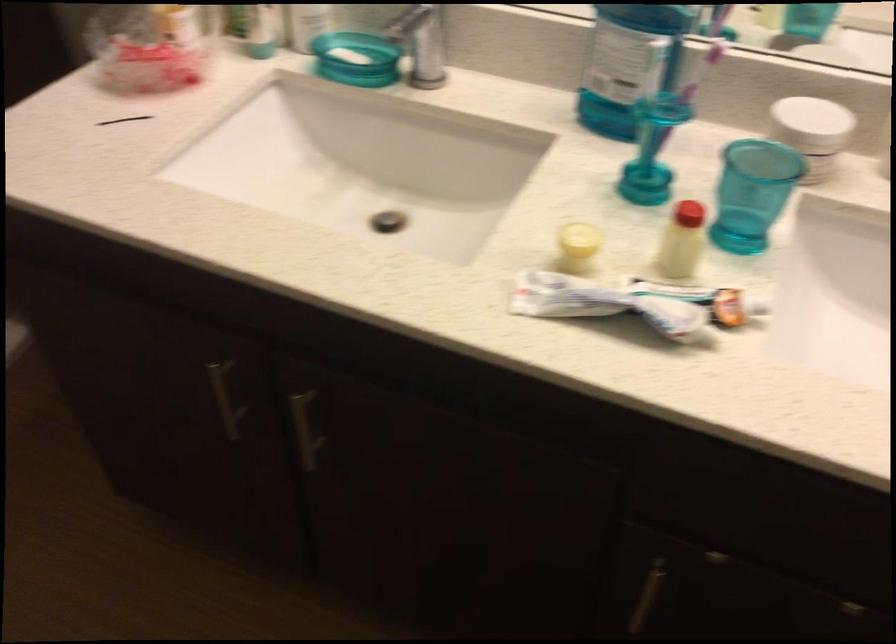
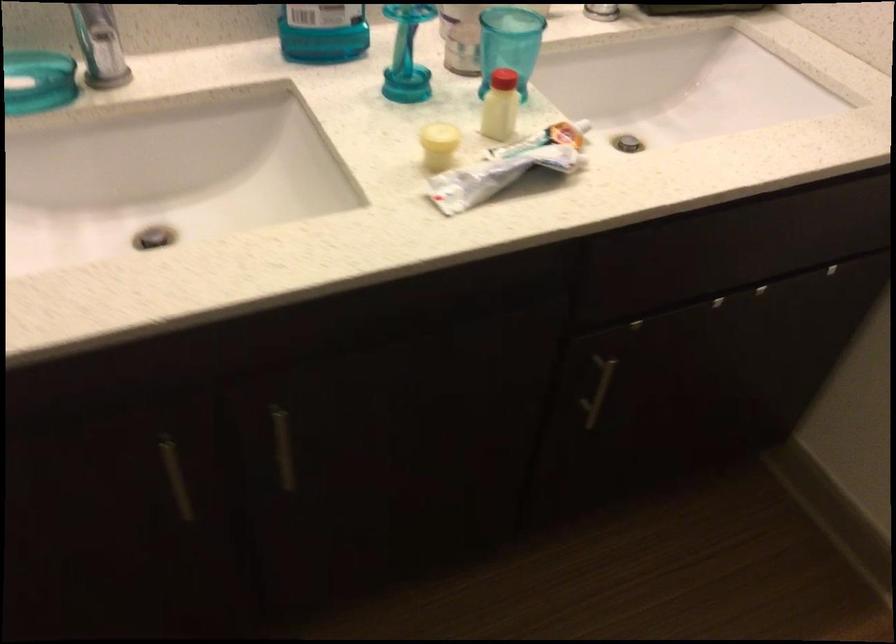
The point at (600, 305) is marked in the first image. Where is the corresponding point in the second image?

(495, 176)